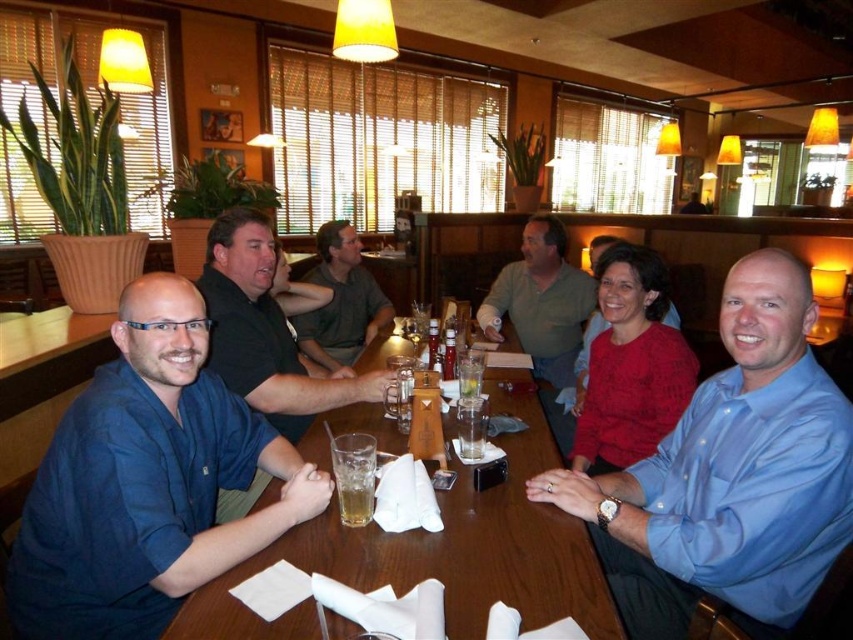
You are a server in the restaurant and need to deliver a drink to the wooden table at center. As you approach, you notice the green fabric shirt at center is blocking your path. Which object should you move around to reach the table?

You should move around the green fabric shirt at center because the wooden table at center is in front of it, meaning the shirt is blocking the path to the table.

You are a waiter at the restaurant and need to deliver a dessert to the table. The dessert needs to be placed between the green fabric shirt at center and the translucent glass beer at table center. Is there enough space between them to place the dessert?

The green fabric shirt at center and the translucent glass beer at table center are 2.09 meters apart, so there is sufficient space to place the dessert between them.

You are a photographer standing at the back of the room. You want to take a photo of the blue cotton shirt at left and the blue shirt at left. The minimum distance between them is 60.92 centimeters. Can you capture both in a single frame without moving either subject?

Yes, since the minimum distance between the blue cotton shirt at left and the blue shirt at left is 60.92 centimeters, which is within the camera frame capacity, you can capture both in a single frame without moving them.